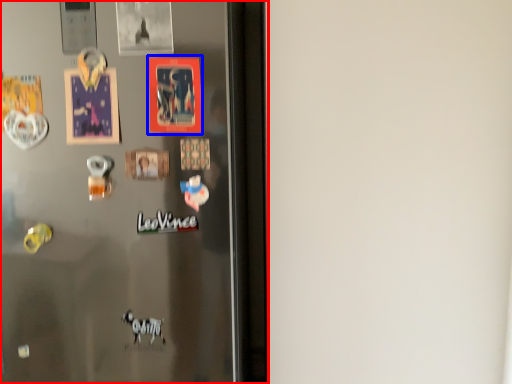
Question: Which object appears closest to the camera in this image, refrigerator (highlighted by a red box) or postcard (highlighted by a blue box)?

Choices:
 (A) refrigerator
 (B) postcard

Answer: (A)